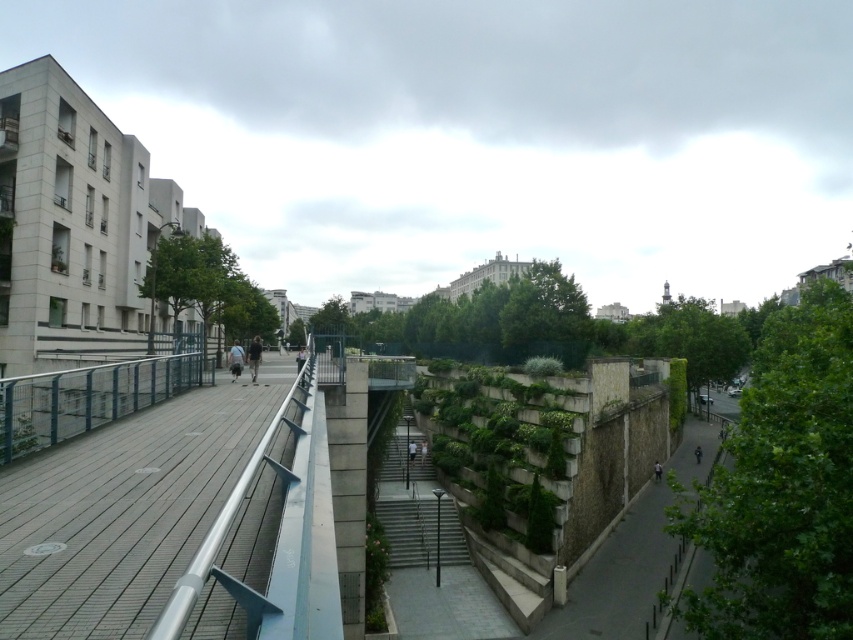
You are a delivery person carrying a large package and need to navigate through the urban scene. You see the silver metallic railing at left and the light gray fabric jacket at center. Which object takes up more space in the image?

The light gray fabric jacket at center takes up more space in the image because the silver metallic railing at left is smaller than it.

Looking at this image, you are standing on the pedestrian bridge and want to know the position of the railings. Which railing is closer to the ground, the silver metallic railing at left or the metallic blue railing at left?

The silver metallic railing at left is closer to the ground because it is positioned below the metallic blue railing at left.